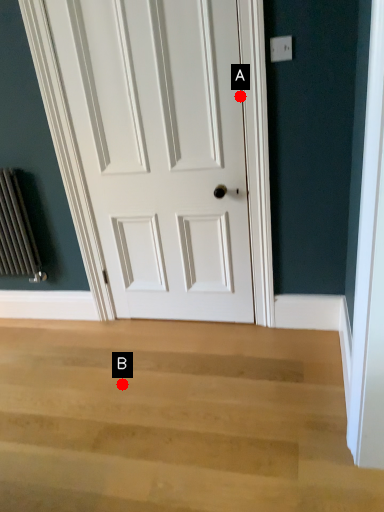
Question: Two points are circled on the image, labeled by A and B beside each circle. Which point is closer to the camera taking this photo?

Choices:
 (A) A is closer
 (B) B is closer

Answer: (A)